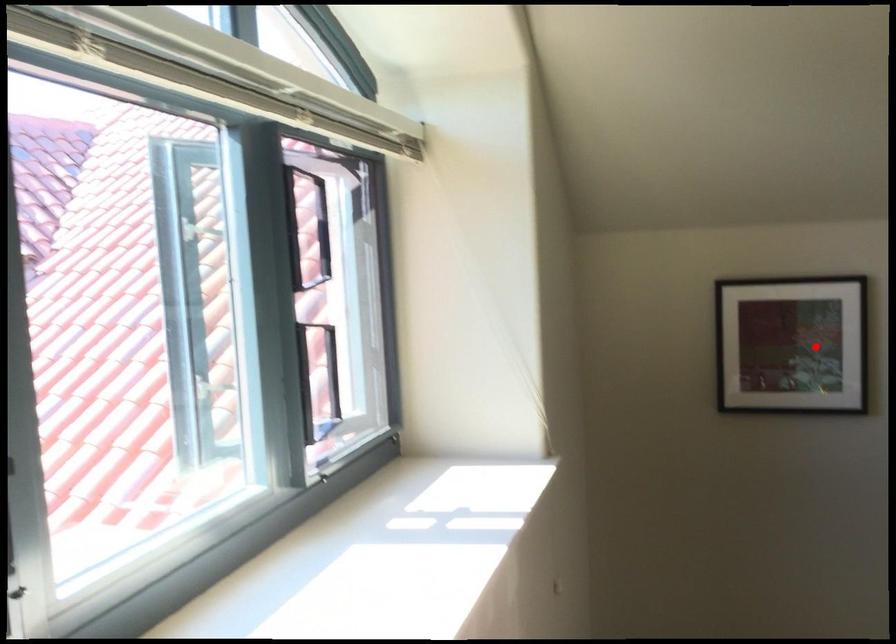
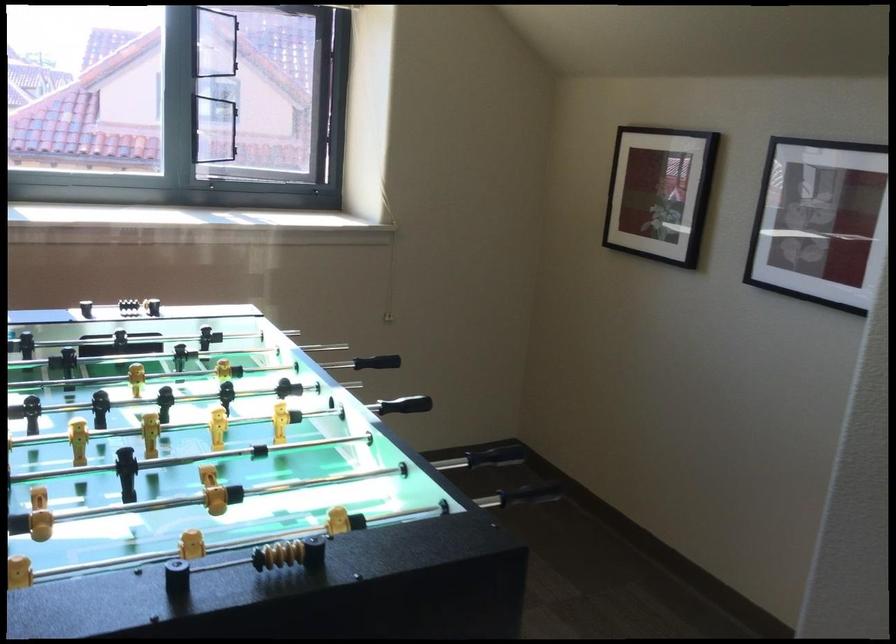
The point at the highlighted location is marked in the first image. Where is the corresponding point in the second image?

(659, 193)